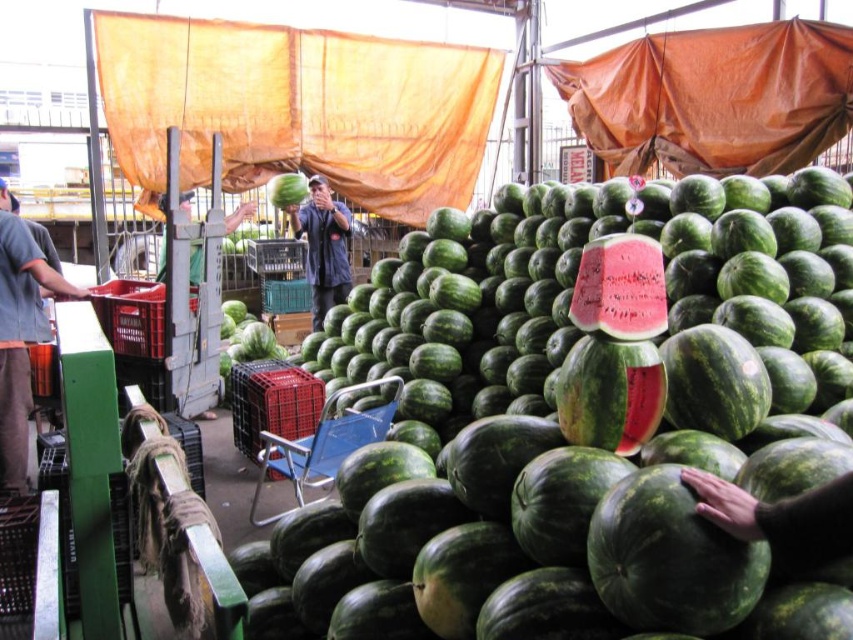
Question: Which object appears closest to the camera in this image?

Choices:
 (A) metallic blue chair at center
 (B) ripe red watermelon at center
 (C) green matte watermelon at center

Answer: (B)

Question: Which point is closer to the camera taking this photo?

Choices:
 (A) (273, 440)
 (B) (643, 240)
 (C) (299, 177)
 (D) (312, 198)

Answer: (B)

Question: Does ripe red watermelon at center appear over dark blue uniform at center?

Choices:
 (A) yes
 (B) no

Answer: (B)

Question: Does ripe red watermelon at center have a larger size compared to green matte watermelon at center?

Choices:
 (A) no
 (B) yes

Answer: (A)

Question: Which object is farther from the camera taking this photo?

Choices:
 (A) dark blue uniform at center
 (B) ripe red watermelon at center

Answer: (A)

Question: Does ripe red watermelon at center appear under green matte watermelon at center?

Choices:
 (A) no
 (B) yes

Answer: (B)